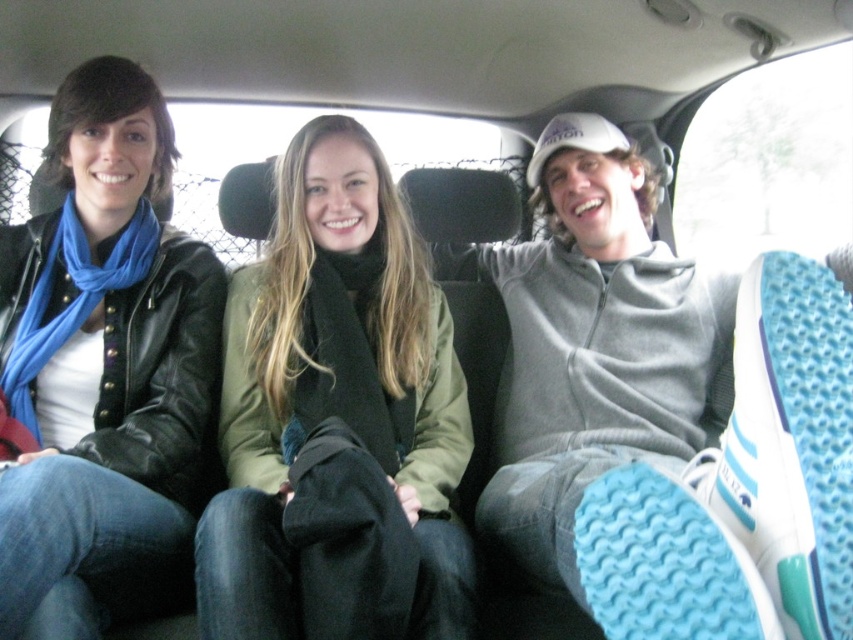
Question: From the image, what is the correct spatial relationship of green matte jacket at center in relation to matte black jacket at left?

Choices:
 (A) below
 (B) above

Answer: (A)

Question: Is green matte jacket at center thinner than matte black jacket at left?

Choices:
 (A) yes
 (B) no

Answer: (B)

Question: Among these points, which one is nearest to the camera?

Choices:
 (A) (440, 464)
 (B) (165, 291)

Answer: (A)

Question: Can you confirm if green matte jacket at center is positioned to the left of matte black jacket at left?

Choices:
 (A) no
 (B) yes

Answer: (A)

Question: Which point appears farthest from the camera in this image?

Choices:
 (A) (32, 307)
 (B) (374, 540)

Answer: (A)

Question: Which of the following is the farthest from the observer?

Choices:
 (A) green matte jacket at center
 (B) matte black jacket at left

Answer: (A)